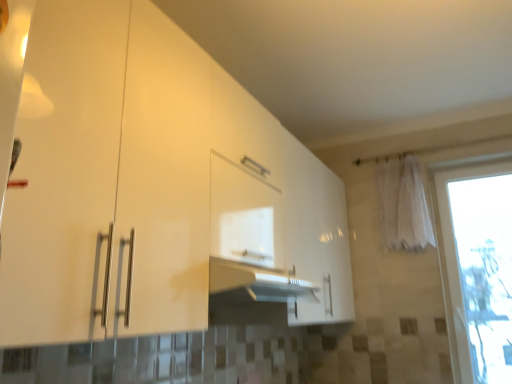
Identify the location of transparent glass window at right. This screenshot has width=512, height=384. (477, 268).

Where is `white glossy cabinet at center`? The image size is (512, 384). white glossy cabinet at center is located at coordinates (151, 185).

The width and height of the screenshot is (512, 384). Find the location of `white fabric curtain at upper right`. white fabric curtain at upper right is located at coordinates (403, 205).

From the image's perspective, is transparent glass window at right below white fabric curtain at upper right?

Yes.

Find the location of a particular element. This screenshot has width=512, height=384. curtain behind the transparent glass window at right is located at coordinates 403,205.

Is point (446, 199) positioned in front of point (394, 226)?

No, it is behind (394, 226).

What's the angular difference between transparent glass window at right and white fabric curtain at upper right's facing directions?

The angular difference between transparent glass window at right and white fabric curtain at upper right is 0.323 degrees.

Does transparent glass window at right have a greater height compared to white glossy cabinet at center?

Correct, transparent glass window at right is much taller as white glossy cabinet at center.

Is transparent glass window at right inside or outside of white glossy cabinet at center?

transparent glass window at right cannot be found inside white glossy cabinet at center.

Is transparent glass window at right positioned far away from white glossy cabinet at center?

transparent glass window at right is positioned a significant distance from white glossy cabinet at center.

Is transparent glass window at right at the left side of white glossy cabinet at center?

No.

Is white glossy cabinet at center beside white fabric curtain at upper right?

white glossy cabinet at center and white fabric curtain at upper right are not in contact.

Is white glossy cabinet at center closer to camera compared to white fabric curtain at upper right?

Yes.

From the image's perspective, is white glossy cabinet at center located above or below white fabric curtain at upper right?

Based on their image positions, white glossy cabinet at center is located beneath white fabric curtain at upper right.

Consider the image. Considering the relative sizes of white glossy cabinet at center and white fabric curtain at upper right in the image provided, is white glossy cabinet at center thinner than white fabric curtain at upper right?

In fact, white glossy cabinet at center might be wider than white fabric curtain at upper right.

From a real-world perspective, is white fabric curtain at upper right physically above white glossy cabinet at center?

Yes.

Are white fabric curtain at upper right and white glossy cabinet at center far apart?

Yes, white fabric curtain at upper right is far from white glossy cabinet at center.

Measure the distance from white fabric curtain at upper right to white glossy cabinet at center.

white fabric curtain at upper right and white glossy cabinet at center are 4.27 feet apart.

Which point is more forward, (426, 228) or (187, 52)?

The point (187, 52) is closer to the camera.

Which object is closer to the camera, white glossy cabinet at center or transparent glass window at right?

white glossy cabinet at center is more forward.

Find the location of a particular element. cabinetry positioned vertically above the transparent glass window at right (from a real-world perspective) is located at coordinates (151, 185).

From the image's perspective, is white glossy cabinet at center located above transparent glass window at right?

Indeed, from the image's perspective, white glossy cabinet at center is shown above transparent glass window at right.

Is white glossy cabinet at center turned away from transparent glass window at right?

That's not correct — white glossy cabinet at center is not looking away from transparent glass window at right.

From a real-world perspective, which object rests below the other?

transparent glass window at right, from a real-world perspective.

Is transparent glass window at right a part of white fabric curtain at upper right?

No, transparent glass window at right is not inside white fabric curtain at upper right.

Does white fabric curtain at upper right have a lesser height compared to transparent glass window at right?

Indeed, white fabric curtain at upper right has a lesser height compared to transparent glass window at right.

At what (x,y) coordinates should I click in order to perform the action: click on curtain on the left of transparent glass window at right. Please return your answer as a coordinate pair (x, y). This screenshot has height=384, width=512. Looking at the image, I should click on (403, 205).

You are a GUI agent. You are given a task and a screenshot of the screen. Output one action in this format:
    pyautogui.click(x=<x>, y=<y>)
    Task: Click on the cabinetry that appears above the transparent glass window at right (from the image's perspective)
    This screenshot has height=384, width=512.
    Given the screenshot: What is the action you would take?
    pyautogui.click(x=151, y=185)

When comparing their distances from white fabric curtain at upper right, does white glossy cabinet at center or transparent glass window at right seem further?

Among the two, white glossy cabinet at center is located further to white fabric curtain at upper right.

When comparing their distances from white fabric curtain at upper right, does transparent glass window at right or white glossy cabinet at center seem closer?

transparent glass window at right lies closer to white fabric curtain at upper right than the other object.

Based on their spatial positions, is transparent glass window at right or white fabric curtain at upper right further from white glossy cabinet at center?

transparent glass window at right is further to white glossy cabinet at center.

From the image, which object appears to be farther from transparent glass window at right, white fabric curtain at upper right or white glossy cabinet at center?

Based on the image, white glossy cabinet at center appears to be further to transparent glass window at right.

Which object lies further to the anchor point transparent glass window at right, white glossy cabinet at center or white fabric curtain at upper right?

Among the two, white glossy cabinet at center is located further to transparent glass window at right.

Based on their spatial positions, is white fabric curtain at upper right or transparent glass window at right closer to white glossy cabinet at center?

The object closer to white glossy cabinet at center is white fabric curtain at upper right.

This screenshot has width=512, height=384. I want to click on window between white glossy cabinet at center and white fabric curtain at upper right along the z-axis, so click(x=477, y=268).